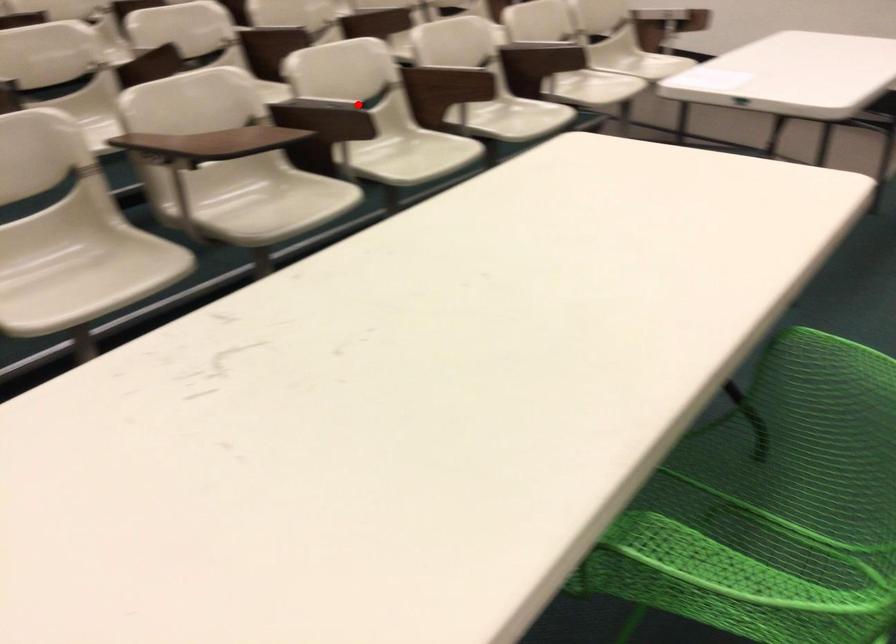
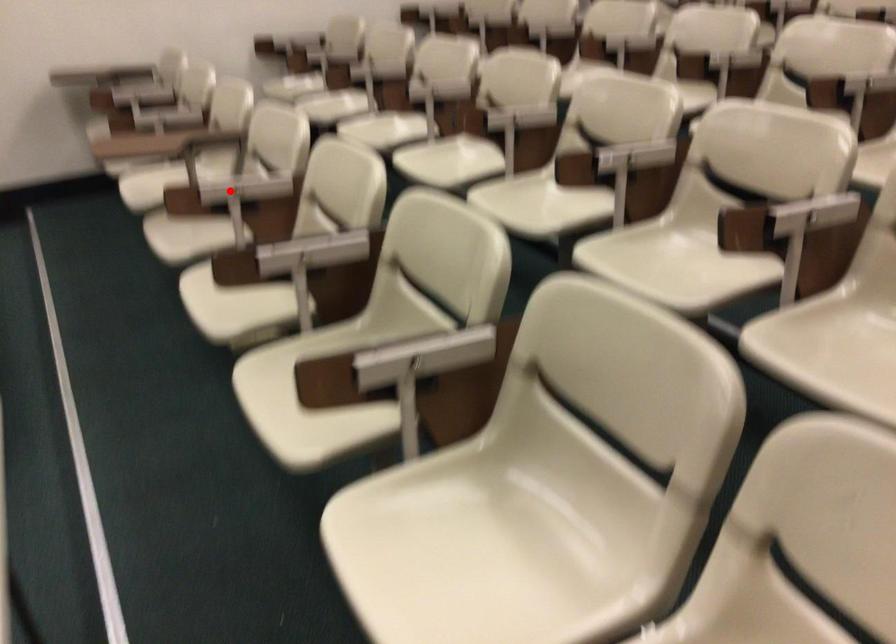
I am providing you with two images of the same scene from different viewpoints. A red point is marked on the first image and another point is marked on the second image. Does the point marked in image1 correspond to the same location as the one in image2?

Yes